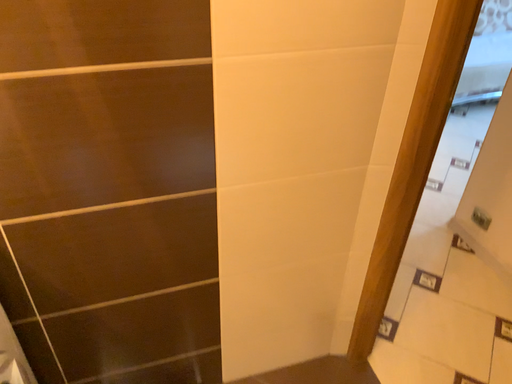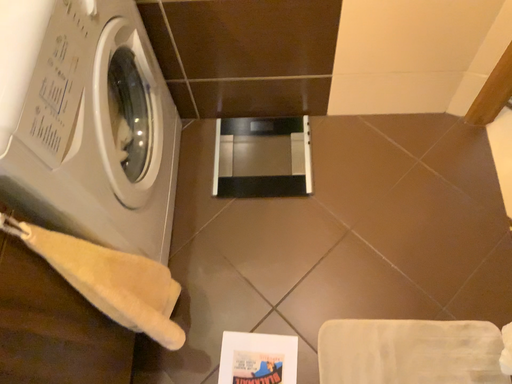
Question: Which way did the camera rotate in the video?

Choices:
 (A) rotated left
 (B) rotated right

Answer: (A)